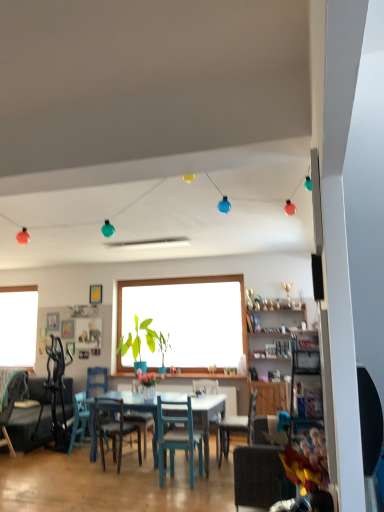
Question: Considering the relative sizes of dark gray fabric couch at lower left and green matte plant at center in the image provided, is dark gray fabric couch at lower left smaller than green matte plant at center?

Choices:
 (A) yes
 (B) no

Answer: (B)

Question: Is dark gray fabric couch at lower left wider than green matte plant at center?

Choices:
 (A) yes
 (B) no

Answer: (A)

Question: Is dark gray fabric couch at lower left to the left of green matte plant at center from the viewer's perspective?

Choices:
 (A) no
 (B) yes

Answer: (B)

Question: Are dark gray fabric couch at lower left and green matte plant at center beside each other?

Choices:
 (A) yes
 (B) no

Answer: (B)

Question: From the image's perspective, is dark gray fabric couch at lower left located above green matte plant at center?

Choices:
 (A) yes
 (B) no

Answer: (B)

Question: Is teal wood chair at center, the fourth chair from the left, in front of or behind wooden chair at center, which is the 3th chair from left to right, in the image?

Choices:
 (A) behind
 (B) front

Answer: (B)

Question: Does point (175, 436) appear closer or farther from the camera than point (119, 407)?

Choices:
 (A) farther
 (B) closer

Answer: (B)

Question: In the image, is teal wood chair at center, the third chair when ordered from right to left, on the left side or the right side of wooden chair at center, which is the 3th chair from left to right?

Choices:
 (A) left
 (B) right

Answer: (B)

Question: In terms of height, does teal wood chair at center, the third chair when ordered from right to left, look taller or shorter compared to wooden chair at center, which is the 3th chair from left to right?

Choices:
 (A) short
 (B) tall

Answer: (B)

Question: Does point coord(135,360) appear closer or farther from the camera than point coord(66,415)?

Choices:
 (A) closer
 (B) farther

Answer: (B)

Question: Looking at their shapes, would you say green matte plant at center is wider or thinner than dark gray fabric couch at lower left?

Choices:
 (A) thin
 (B) wide

Answer: (A)

Question: Based on their positions, is green matte plant at center located to the left or right of dark gray fabric couch at lower left?

Choices:
 (A) right
 (B) left

Answer: (A)

Question: From a real-world perspective, is green matte plant at center above or below dark gray fabric couch at lower left?

Choices:
 (A) below
 (B) above

Answer: (B)

Question: Considering their positions, is teal wood chair at lower left, the 5th chair when ordered from right to left, located in front of or behind matte teal chair at center, the 2th chair from the right?

Choices:
 (A) behind
 (B) front

Answer: (A)

Question: From their relative heights in the image, would you say teal wood chair at lower left, positioned as the 2th chair in left-to-right order, is taller or shorter than matte teal chair at center, the 2th chair from the right?

Choices:
 (A) short
 (B) tall

Answer: (A)